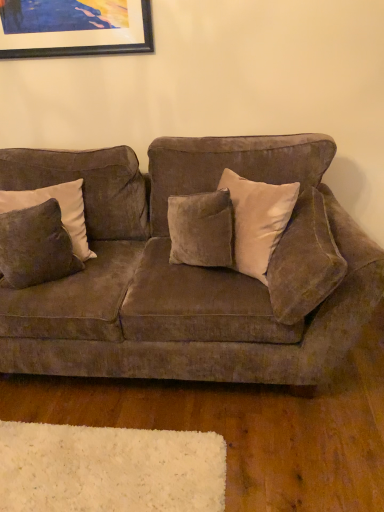
Question: Is velvet brown couch at center to the left of suede pillow at right, the first pillow from the right, from the viewer's perspective?

Choices:
 (A) no
 (B) yes

Answer: (B)

Question: Considering the relative sizes of velvet brown couch at center and suede pillow at right, positioned as the second pillow in left-to-right order, in the image provided, is velvet brown couch at center wider than suede pillow at right, positioned as the second pillow in left-to-right order,?

Choices:
 (A) yes
 (B) no

Answer: (A)

Question: Is velvet brown couch at center not near suede pillow at right, the first pillow from the right?

Choices:
 (A) no
 (B) yes

Answer: (A)

Question: Is velvet brown couch at center outside of suede pillow at right, the first pillow from the right?

Choices:
 (A) yes
 (B) no

Answer: (A)

Question: Considering the relative sizes of velvet brown couch at center and suede pillow at right, the first pillow from the right, in the image provided, is velvet brown couch at center smaller than suede pillow at right, the first pillow from the right,?

Choices:
 (A) no
 (B) yes

Answer: (A)

Question: From a real-world perspective, relative to wooden picture frame at upper left, is velvet brown couch at center vertically above or below?

Choices:
 (A) above
 (B) below

Answer: (B)

Question: In terms of width, does velvet brown couch at center look wider or thinner when compared to wooden picture frame at upper left?

Choices:
 (A) thin
 (B) wide

Answer: (B)

Question: Considering the positions of velvet brown couch at center and wooden picture frame at upper left in the image, is velvet brown couch at center taller or shorter than wooden picture frame at upper left?

Choices:
 (A) tall
 (B) short

Answer: (A)

Question: Do you think velvet brown couch at center is within wooden picture frame at upper left, or outside of it?

Choices:
 (A) outside
 (B) inside

Answer: (A)

Question: In terms of height, does velvet brown pillow at left, placed as the 2th pillow when sorted from right to left, look taller or shorter compared to wooden picture frame at upper left?

Choices:
 (A) tall
 (B) short

Answer: (A)

Question: Based on their sizes in the image, would you say velvet brown pillow at left, placed as the 2th pillow when sorted from right to left, is bigger or smaller than wooden picture frame at upper left?

Choices:
 (A) small
 (B) big

Answer: (B)

Question: Is velvet brown pillow at left, placed as the 2th pillow when sorted from right to left, situated inside wooden picture frame at upper left or outside?

Choices:
 (A) outside
 (B) inside

Answer: (A)

Question: Considering their positions, is velvet brown pillow at left, placed as the 2th pillow when sorted from right to left, located in front of or behind wooden picture frame at upper left?

Choices:
 (A) behind
 (B) front

Answer: (B)

Question: From a real-world perspective, is velvet brown couch at center positioned above or below suede pillow at right, the first pillow from the right?

Choices:
 (A) above
 (B) below

Answer: (B)

Question: Considering the positions of point (365, 306) and point (279, 305), is point (365, 306) closer or farther from the camera than point (279, 305)?

Choices:
 (A) closer
 (B) farther

Answer: (A)